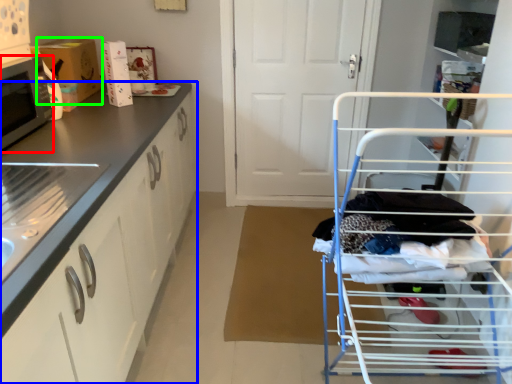
Question: Based on their relative distances, which object is farther from microwave oven (highlighted by a red box)? Choose from cabinetry (highlighted by a blue box) and cardboard box (highlighted by a green box).

Choices:
 (A) cabinetry
 (B) cardboard box

Answer: (B)